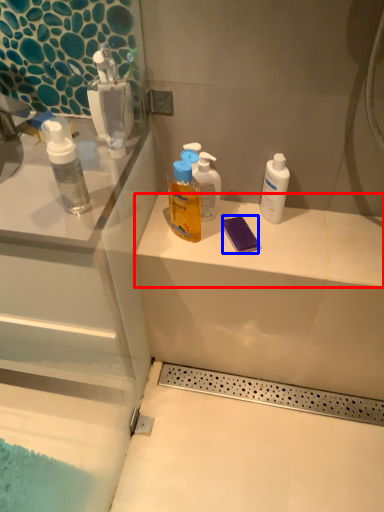
Question: Which object is closer to the camera taking this photo, counter top (highlighted by a red box) or soap (highlighted by a blue box)?

Choices:
 (A) counter top
 (B) soap

Answer: (A)